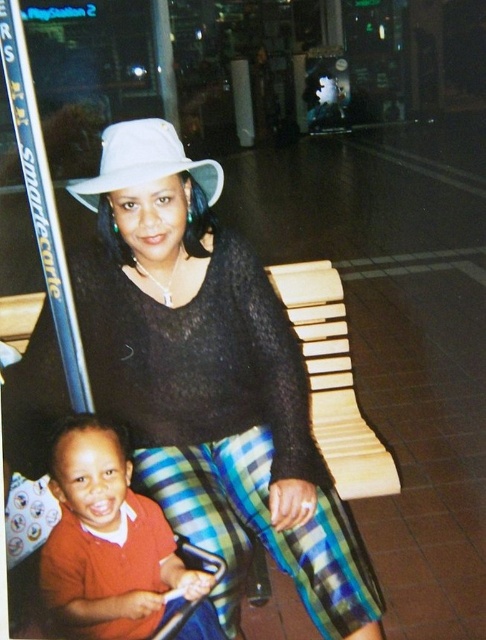
Who is more forward, (119, 340) or (73, 541)?

Point (73, 541) is in front.

Where is `matte black sweater at center`? Image resolution: width=486 pixels, height=640 pixels. matte black sweater at center is located at coordinates (210, 381).

Can you confirm if matte black sweater at center is positioned to the right of white matte baseball hat at upper center?

Yes, matte black sweater at center is to the right of white matte baseball hat at upper center.

I want to click on matte black sweater at center, so click(x=210, y=381).

Is matte orange shirt at lower left closer to camera compared to white matte baseball hat at upper center?

Yes.

Who is higher up, matte orange shirt at lower left or white matte baseball hat at upper center?

white matte baseball hat at upper center is higher up.

Which is in front, point (128, 502) or point (115, 182)?

Positioned in front is point (128, 502).

Where is `matte orange shirt at lower left`? The width and height of the screenshot is (486, 640). matte orange shirt at lower left is located at coordinates (107, 541).